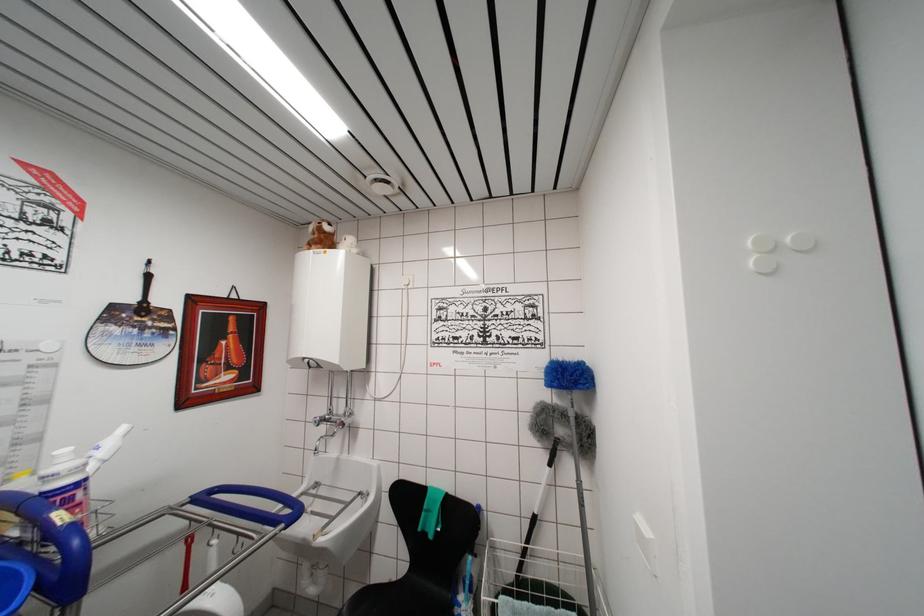
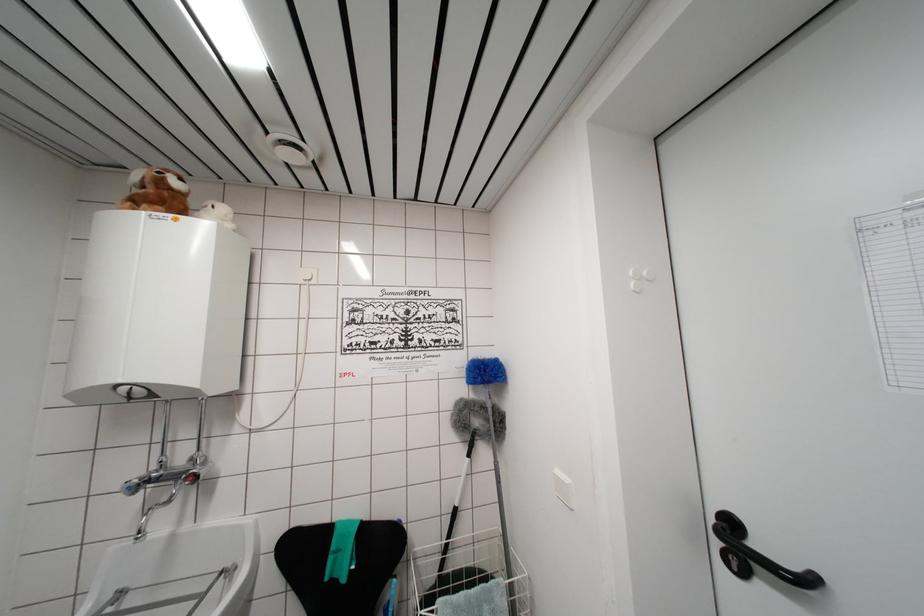
Question: The camera is either moving clockwise (left) or counter-clockwise (right) around the object. The first image is from the beginning of the video and the second image is from the end. Is the camera moving left or right when shooting the video?

Choices:
 (A) Left
 (B) Right

Answer: (A)